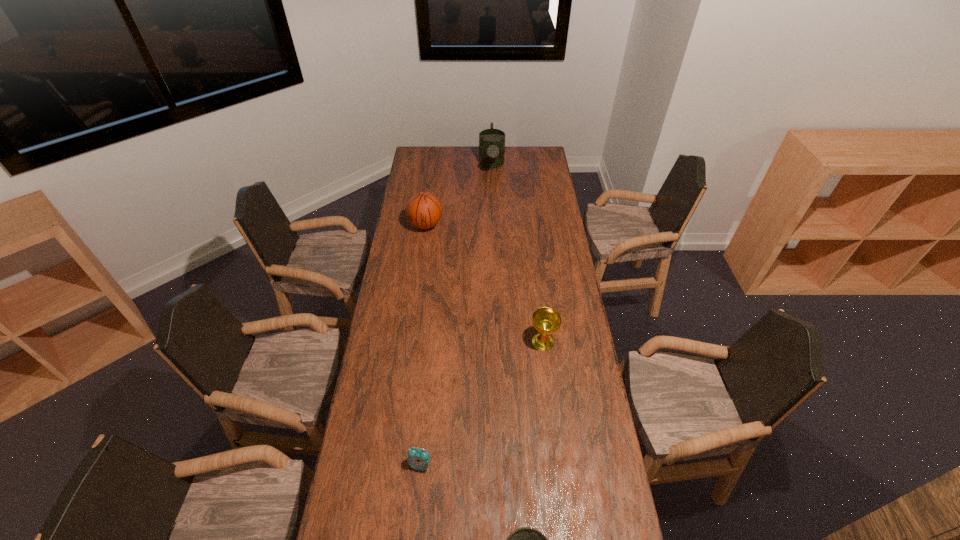
Where is `the farthest object`? This screenshot has height=540, width=960. the farthest object is located at coordinates (491, 141).

The width and height of the screenshot is (960, 540). What are the coordinates of `the second farthest object` in the screenshot? It's located at (423, 210).

Find the location of a particular element. This screenshot has height=540, width=960. the second tallest object is located at coordinates (423, 210).

Where is `chalice`? Image resolution: width=960 pixels, height=540 pixels. chalice is located at coordinates (546, 321).

Where is `the rightmost object`? The height and width of the screenshot is (540, 960). the rightmost object is located at coordinates (546, 321).

What are the coordinates of `alarm clock` in the screenshot? It's located at (418, 459).

Where is `the second shortest object`? The height and width of the screenshot is (540, 960). the second shortest object is located at coordinates (418, 459).

This screenshot has height=540, width=960. I want to click on free space located with the spout on the watering can, so click(493, 211).

This screenshot has height=540, width=960. Find the location of `free spot located 0.070m on the right of the basketball`. free spot located 0.070m on the right of the basketball is located at coordinates (458, 225).

This screenshot has width=960, height=540. Find the location of `free space located on the left of the third farthest object`. free space located on the left of the third farthest object is located at coordinates (456, 342).